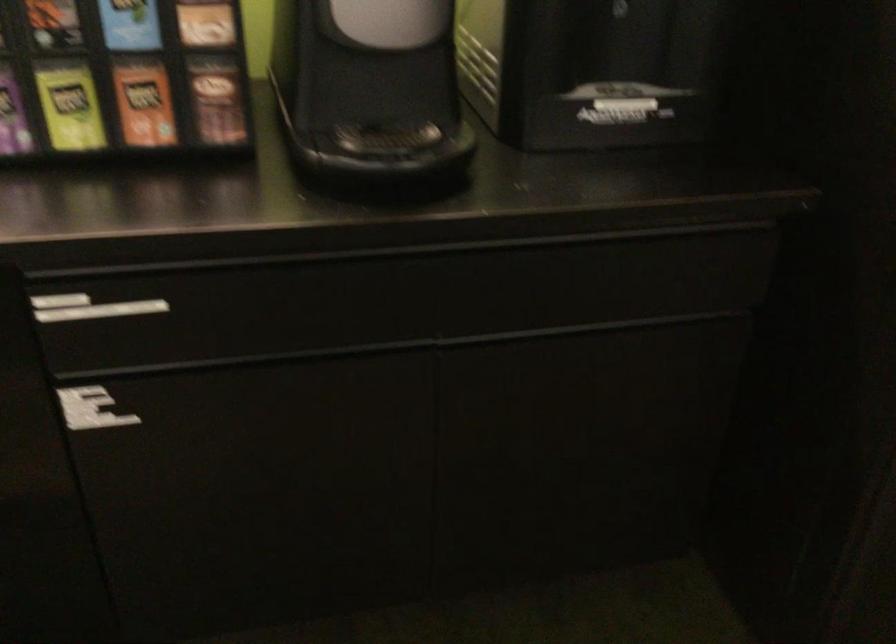
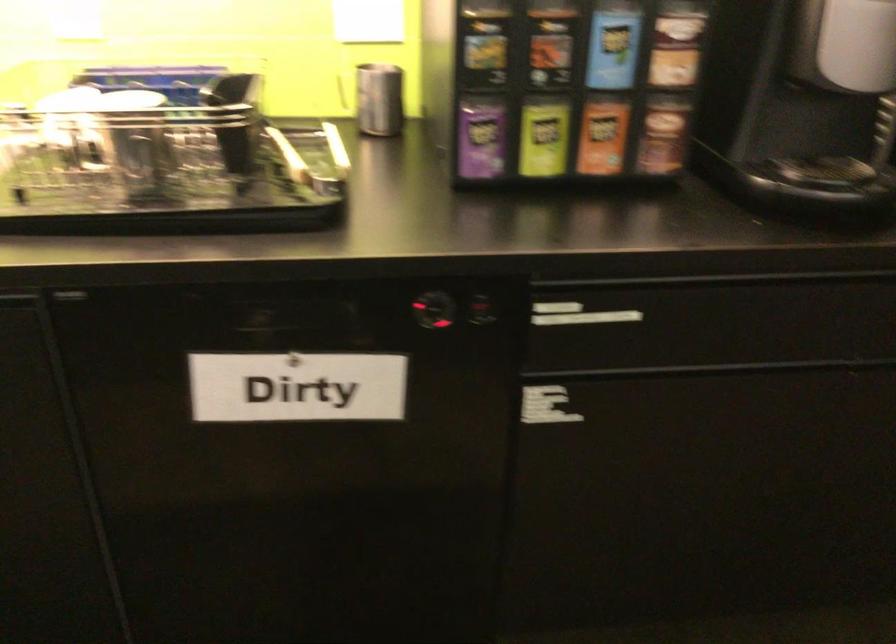
Question: What movement of the cameraman would produce the second image?

Choices:
 (A) Left
 (B) Right
 (C) Forward
 (D) Backward

Answer: (A)